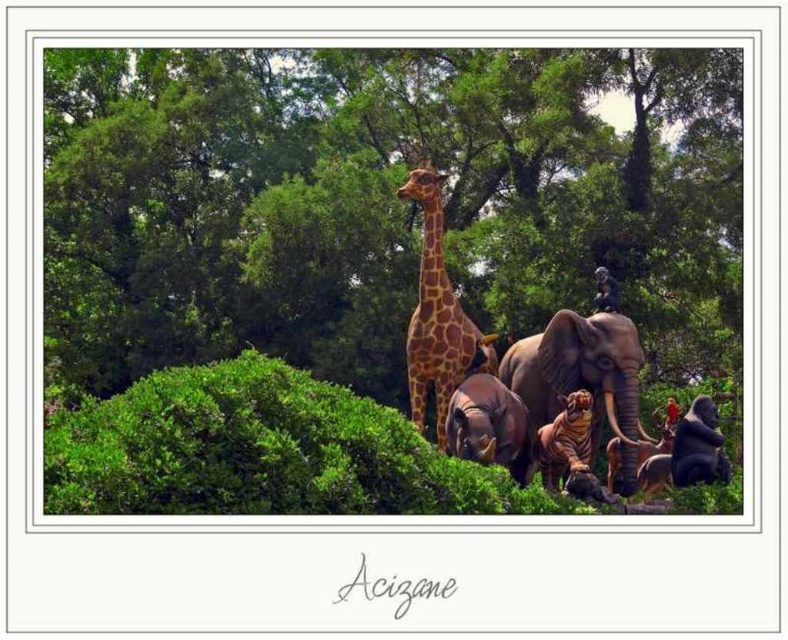
You are standing in front of the animal sculptures and want to move from the shiny brown tiger at center to the shiny black gorilla at lower right. Which direction should you move to reach it?

The shiny brown tiger at center is to the left of the shiny black gorilla at lower right, so you should move to the right to reach the shiny black gorilla at lower right.

You are standing in front of the group of animal sculptures. You see the metallic statue at center and the rustic brown elephant at center. Which one is positioned to the left?

The metallic statue at center is positioned to the left of the rustic brown elephant at center.

You are a visitor at the sculpture garden and want to take a photo of both the shiny brown tiger at center and the shiny black gorilla at lower right. Which sculpture should you focus on first if you want to capture both in the same frame without moving your camera?

You should focus on the shiny brown tiger at center first because it is taller than the shiny black gorilla at lower right, so positioning it centrally will ensure both fit in the frame.